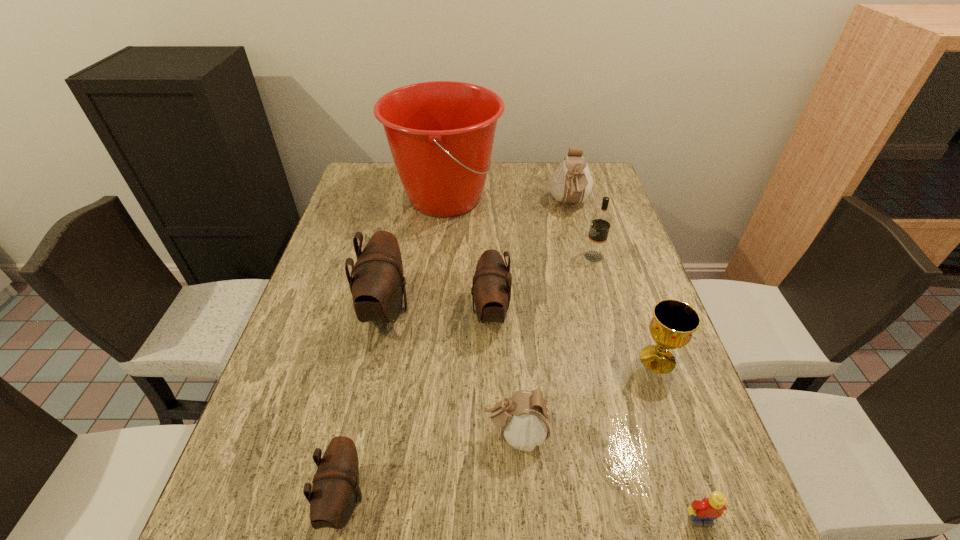
Locate an element on the screen. The image size is (960, 540). brown pouch that is the nearest to the rightmost pouch is located at coordinates (491, 288).

Point out which brown pouch is positioned as the nearest to the seventh nearest object. Please provide its 2D coordinates. Your answer should be formatted as a tuple, i.e. [(x, y)], where the tuple contains the x and y coordinates of a point satisfying the conditions above.

[(491, 288)]

At what (x,y) coordinates should I click in order to perform the action: click on free location that satisfies the following two spatial constraints: 1. with the handle attached to the rim of the chalice; 2. on the right side of the tallest object. Please return your answer as a coordinate pair (x, y). Looking at the image, I should click on (428, 359).

Locate an element on the screen. free region that satisfies the following two spatial constraints: 1. on the label of the vodka; 2. on the right side of the gold chalice is located at coordinates (623, 359).